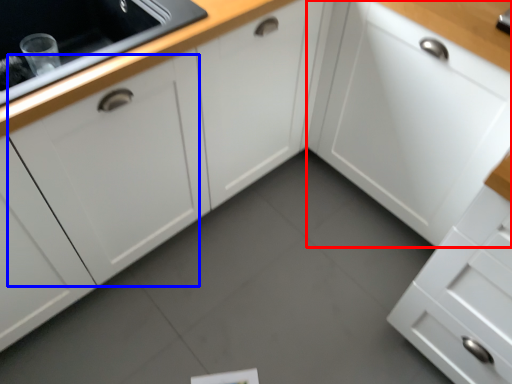
Question: Which object is closer to the camera taking this photo, cabinetry (highlighted by a red box) or cabinetry (highlighted by a blue box)?

Choices:
 (A) cabinetry
 (B) cabinetry

Answer: (B)